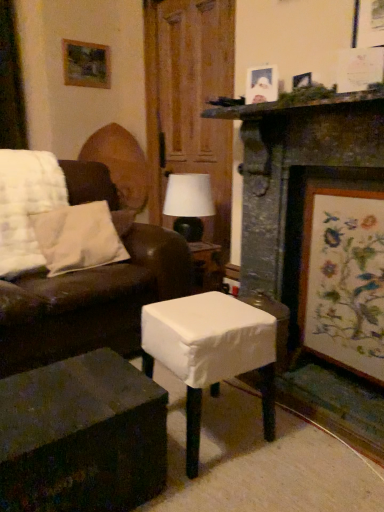
Locate an element on the screen. blank space situated above white fabric-covered stool at center, positioned as the second table in left-to-right order (from a real-world perspective) is located at coordinates click(210, 310).